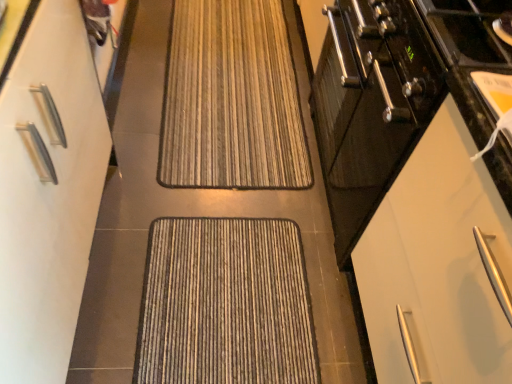
I want to click on free spot above textured brown doormat at center, the first doormat positioned from the bottom (from a real-world perspective), so click(x=220, y=291).